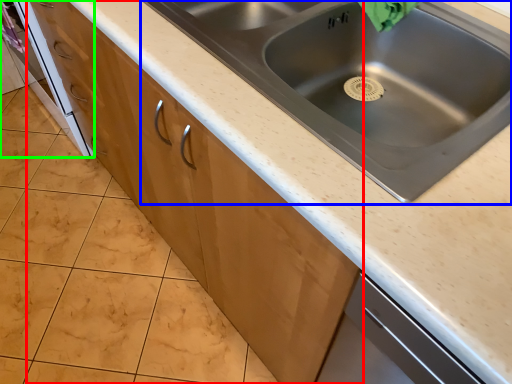
Question: Based on their relative distances, which object is farther from cabinetry (highlighted by a red box)? Choose from sink (highlighted by a blue box) and oven (highlighted by a green box).

Choices:
 (A) sink
 (B) oven

Answer: (B)